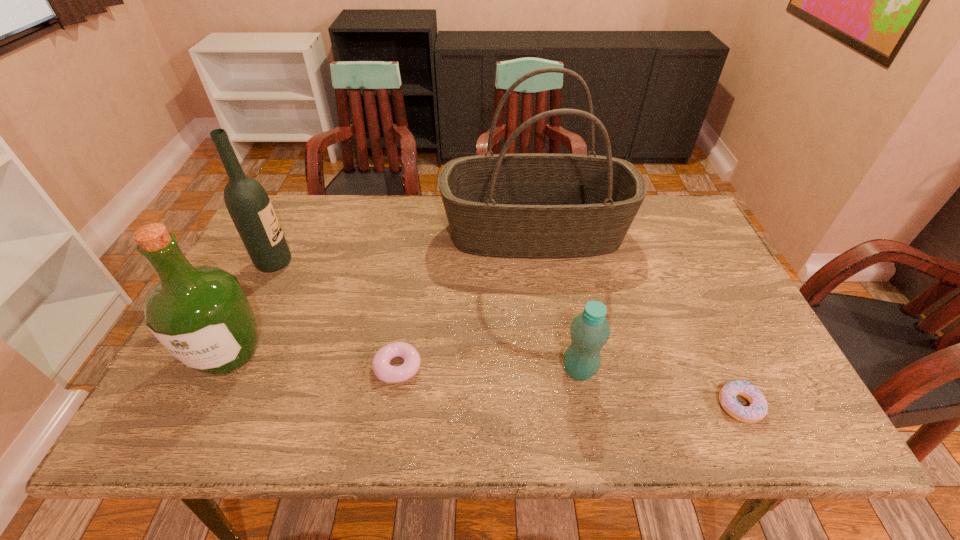
This screenshot has width=960, height=540. What are the coordinates of `vacant area at the far edge` in the screenshot? It's located at 350,197.

I want to click on free space at the near edge of the desktop, so click(x=585, y=433).

The image size is (960, 540). In the image, there is a desktop. Identify the location of free region at the left edge. (288, 284).

This screenshot has width=960, height=540. Identify the location of free space at the right edge. pyautogui.click(x=695, y=243).

The width and height of the screenshot is (960, 540). Find the location of `free space at the far right corner of the desktop`. free space at the far right corner of the desktop is located at coordinates (686, 218).

Locate an element on the screen. The height and width of the screenshot is (540, 960). free space between the liquor and the fourth tallest object is located at coordinates (404, 362).

In order to click on unoccupied area between the basket and the rightmost object in this screenshot , I will do `click(637, 319)`.

Find the location of `vacant space that is in between the water bottle and the rightmost object`. vacant space that is in between the water bottle and the rightmost object is located at coordinates (660, 388).

What are the coordinates of `unoccupied position between the left doughnut and the fourth tallest object` in the screenshot? It's located at (489, 369).

At what (x,y) coordinates should I click in order to perform the action: click on free space between the wine bottle and the water bottle. Please return your answer as a coordinate pair (x, y). Looking at the image, I should click on (427, 316).